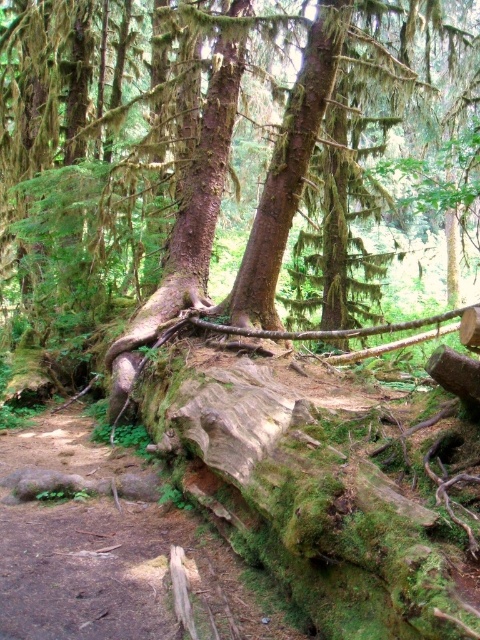
Question: Among these points, which one is farthest from the camera?

Choices:
 (A) click(57, 300)
 (B) click(288, 204)

Answer: (A)

Question: Observing the image, what is the correct spatial positioning of green mossy log at lower center in reference to green mossy tree trunk at center?

Choices:
 (A) above
 (B) below

Answer: (A)

Question: Observing the image, what is the correct spatial positioning of green mossy log at lower center in reference to green mossy tree trunk at center?

Choices:
 (A) left
 (B) right

Answer: (B)

Question: Is green mossy log at lower center to the right of green mossy tree trunk at center from the viewer's perspective?

Choices:
 (A) yes
 (B) no

Answer: (A)

Question: Among these objects, which one is farthest from the camera?

Choices:
 (A) green mossy log at lower center
 (B) green mossy tree trunk at center

Answer: (B)